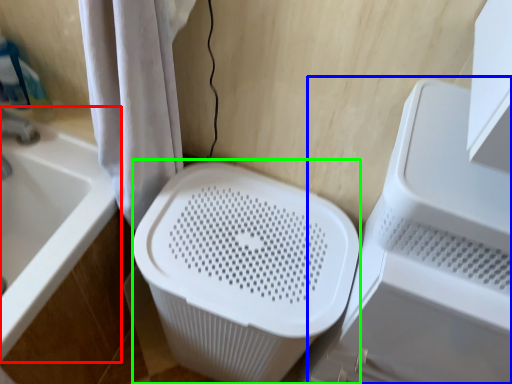
Question: Considering the real-world distances, which object is closest to bathtub (highlighted by a red box)? appliance (highlighted by a blue box) or laundry basket (highlighted by a green box).

Choices:
 (A) appliance
 (B) laundry basket

Answer: (B)